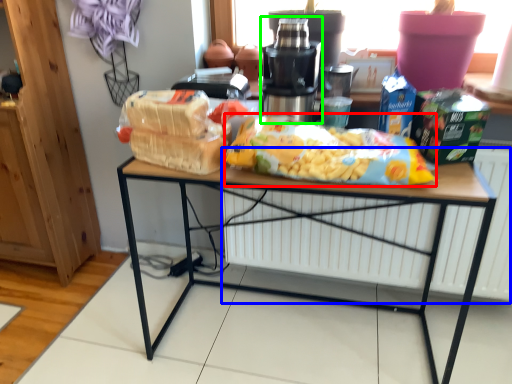
Question: Based on their relative distances, which object is nearer to cereal (highlighted by a red box)? Choose from radiator (highlighted by a blue box) and tableware (highlighted by a green box).

Choices:
 (A) radiator
 (B) tableware

Answer: (B)